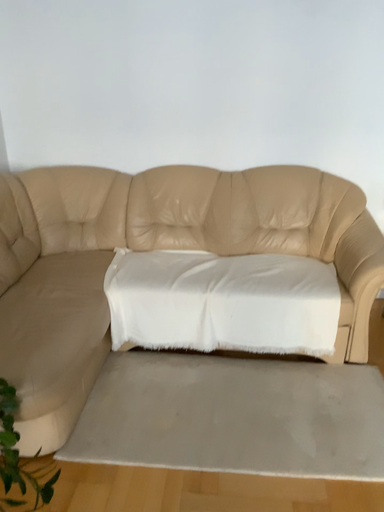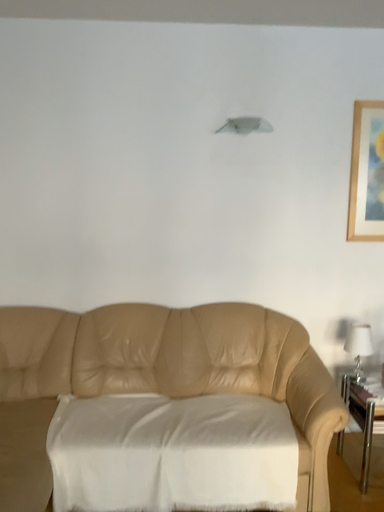
Question: How did the camera likely rotate when shooting the video?

Choices:
 (A) rotated upward
 (B) rotated downward

Answer: (A)